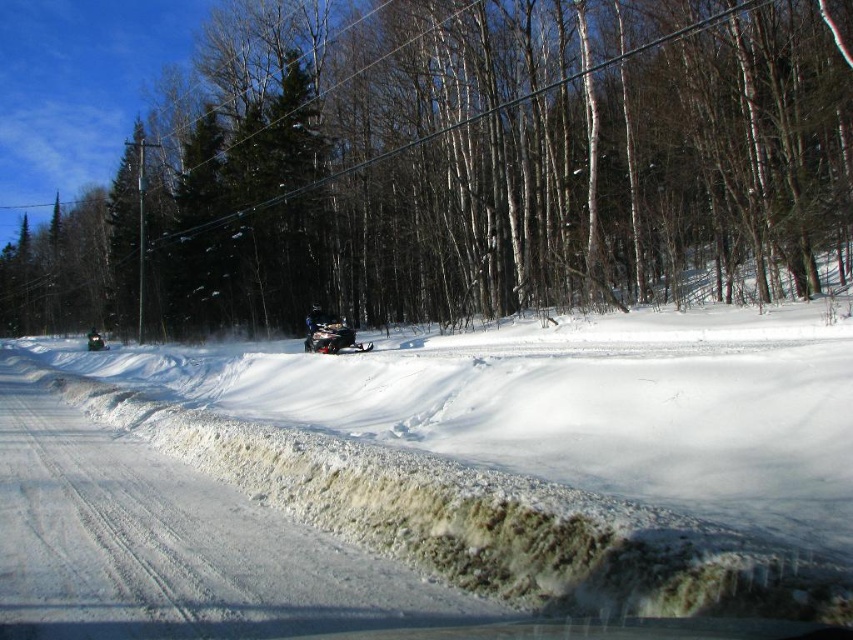
Consider the image. Can you confirm if brown wood tree at center is positioned above white snow ski slope at left?

Correct, brown wood tree at center is located above white snow ski slope at left.

Based on the photo, does brown wood tree at center have a lesser height compared to white snow ski slope at left?

No, brown wood tree at center is not shorter than white snow ski slope at left.

The height and width of the screenshot is (640, 853). I want to click on brown wood tree at center, so click(x=462, y=168).

Which is in front, point (654, 163) or point (91, 337)?

Point (654, 163) is in front.

Does brown wood tree at center appear on the left side of shiny black snowmobile at center?

No, brown wood tree at center is not to the left of shiny black snowmobile at center.

In the scene shown: Measure the distance between point (289, 67) and camera.

45.03 meters

The width and height of the screenshot is (853, 640). In order to click on brown wood tree at center in this screenshot , I will do `click(462, 168)`.

Does white snow ski slope at left have a greater height compared to shiny silver snowmobile at center?

Correct, white snow ski slope at left is much taller as shiny silver snowmobile at center.

Which of these two, white snow ski slope at left or shiny silver snowmobile at center, stands taller?

With more height is white snow ski slope at left.

Does point (808, 486) lie in front of point (337, 330)?

Yes, point (808, 486) is closer to viewer.

You are a GUI agent. You are given a task and a screenshot of the screen. Output one action in this format:
    pyautogui.click(x=<x>, y=<y>)
    Task: Click on the white snow ski slope at left
    
    Given the screenshot: What is the action you would take?
    pyautogui.click(x=537, y=451)